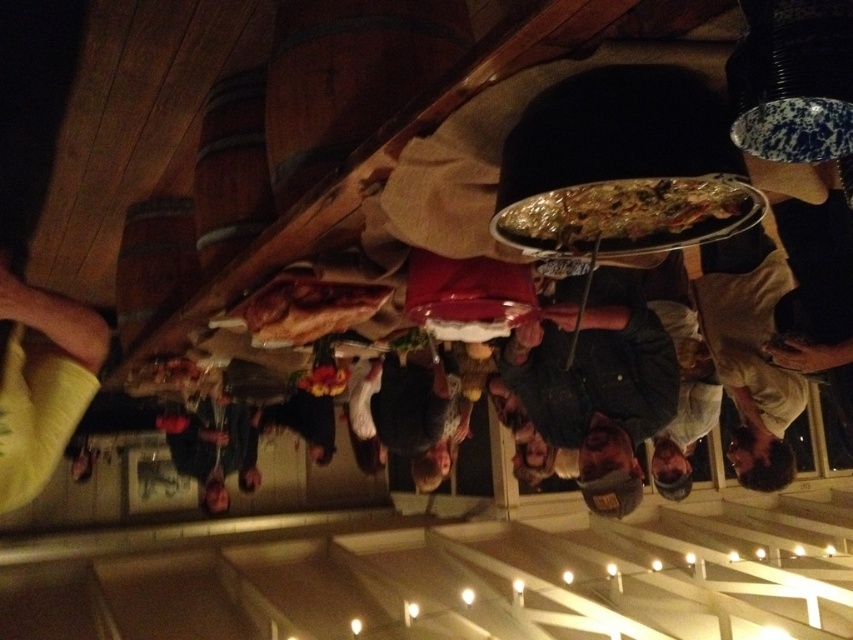
Question: Which of the following is the closest to the observer?

Choices:
 (A) tap(263, 296)
 (B) tap(579, 227)

Answer: (B)

Question: Which point appears farthest from the camera in this image?

Choices:
 (A) (650, 195)
 (B) (704, 339)

Answer: (B)

Question: Which of the following is the closest to the observer?

Choices:
 (A) golden brown crusty bread at center
 (B) white cotton shirt at center
 (C) yellow fabric at lower left
 (D) shiny metallic pizza at center

Answer: (D)

Question: Is shiny metallic pizza at center thinner than golden brown crusty bread at center?

Choices:
 (A) yes
 (B) no

Answer: (A)

Question: Can you confirm if yellow fabric at lower left is positioned above shiny metallic pizza at center?

Choices:
 (A) yes
 (B) no

Answer: (B)

Question: Can you confirm if white cotton shirt at center is positioned above shiny metallic pizza at center?

Choices:
 (A) no
 (B) yes

Answer: (A)